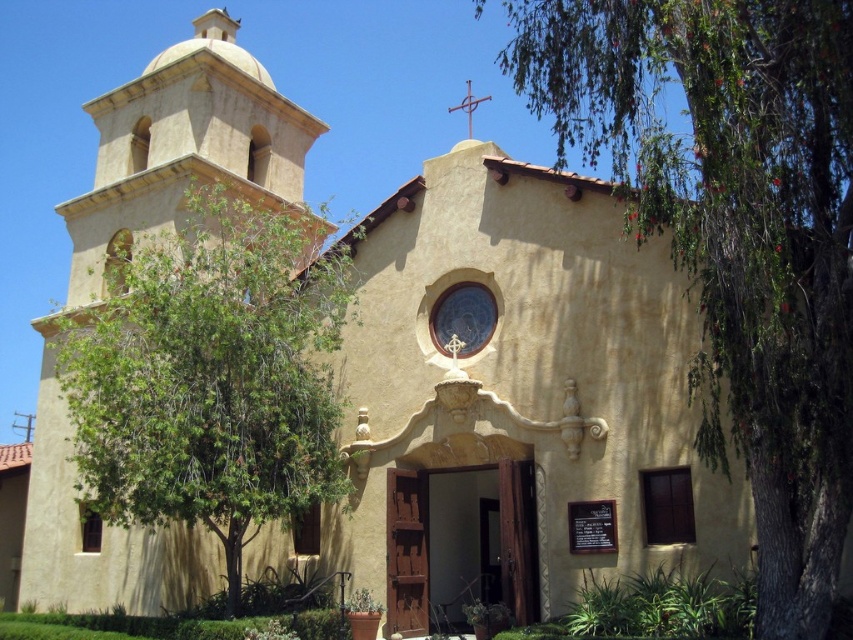
Question: Is green leafy tree at right in front of green leafy tree at left?

Choices:
 (A) yes
 (B) no

Answer: (A)

Question: Which object is farther from the camera taking this photo?

Choices:
 (A) green leafy tree at left
 (B) green leafy tree at right

Answer: (A)

Question: Where is green leafy tree at right located in relation to green leafy tree at left in the image?

Choices:
 (A) above
 (B) below

Answer: (A)

Question: Among these objects, which one is nearest to the camera?

Choices:
 (A) green leafy tree at left
 (B) green leafy tree at right

Answer: (B)

Question: Is green leafy tree at right below green leafy tree at left?

Choices:
 (A) no
 (B) yes

Answer: (A)